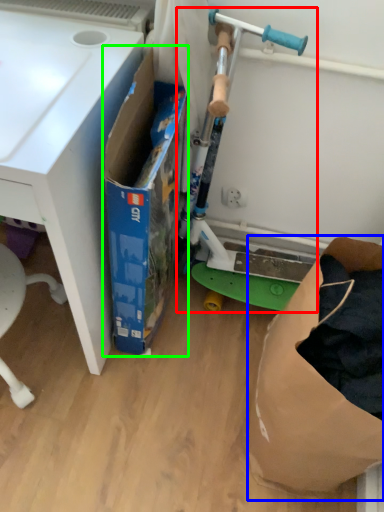
Question: Estimate the real-world distances between objects in this image. Which object is closer to appliance (highlighted by a red box), paper bag (highlighted by a blue box) or box (highlighted by a green box)?

Choices:
 (A) paper bag
 (B) box

Answer: (B)